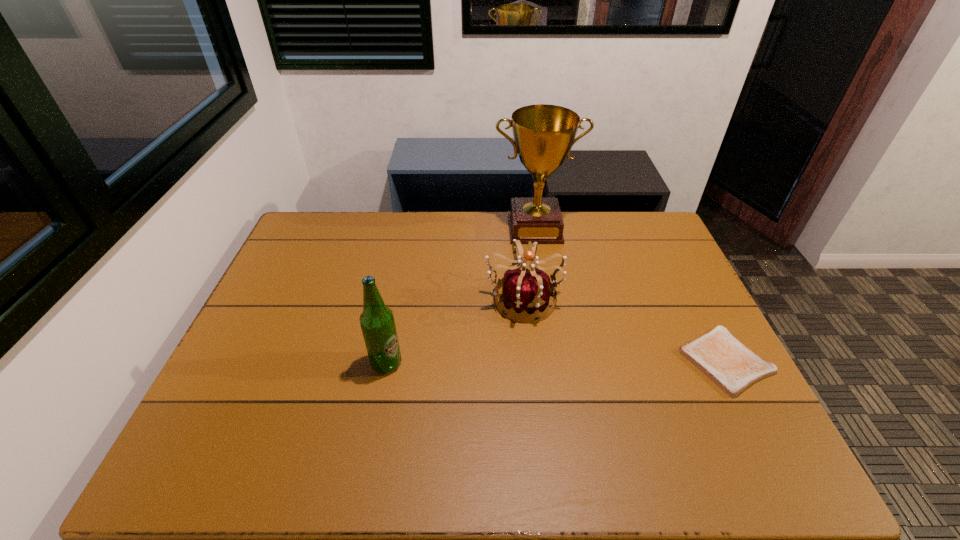
The image size is (960, 540). I want to click on vacant space on the desktop that is between the third shortest object and the rightmost object and is positioned on the plaque of the tallest object, so click(554, 362).

Locate an element on the screen. vacant space on the desktop that is between the third shortest object and the shortest object and is positioned on the front-facing side of the third tallest object is located at coordinates (555, 362).